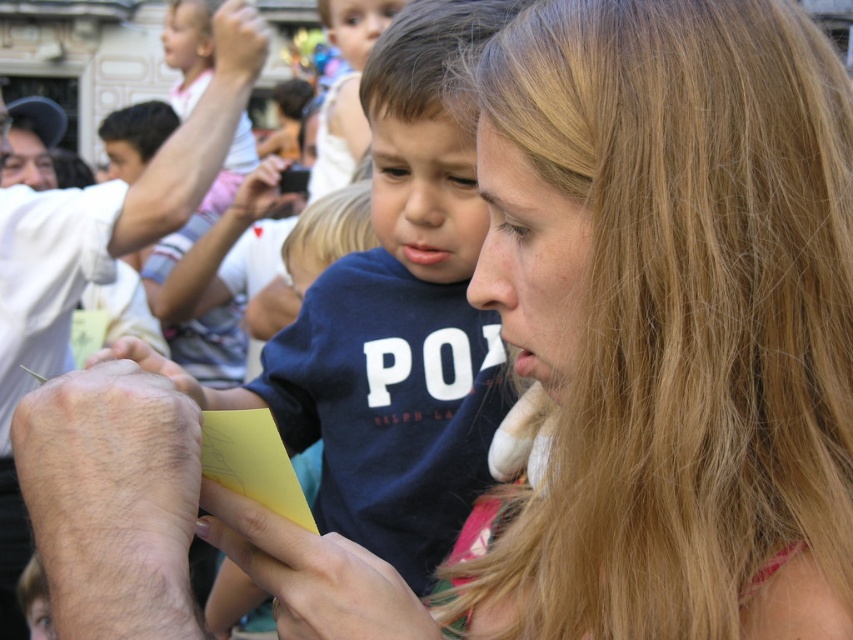
You are a photographer taking a picture of the scene described. The camera you are using has a maximum focus range of 70 meters. Can you clearly capture the hairy skin at lower left in this photo?

The hairy skin at lower left and camera are 73.56 meters apart. Since the camera can only focus up to 70 meters, it cannot clearly capture the hairy skin at lower left.